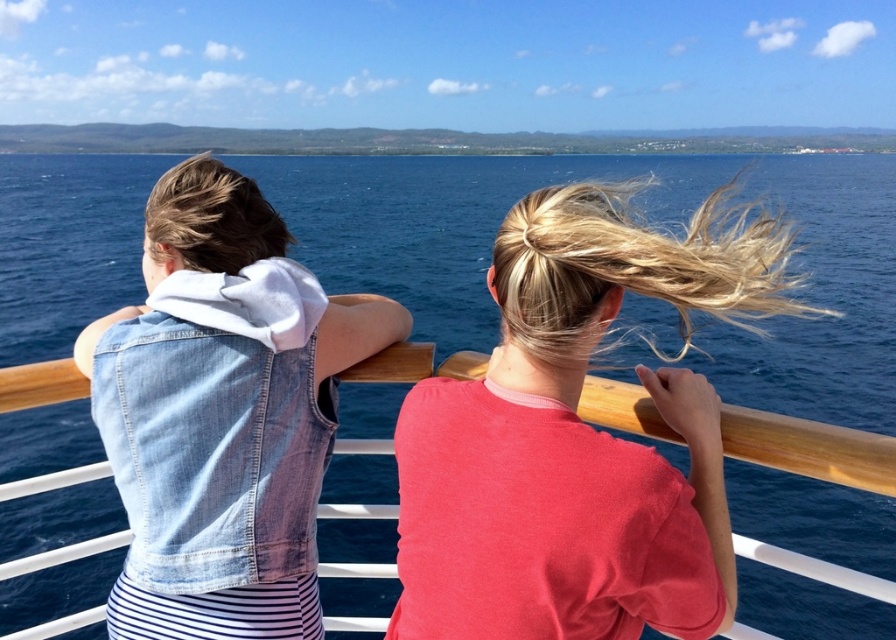
Is denim vest at left bigger than blonde silky hair at upper left?

Incorrect, denim vest at left is not larger than blonde silky hair at upper left.

Is denim vest at left wider than blonde silky hair at upper left?

No.

Measure the distance between denim vest at left and camera.

denim vest at left is 2.20 meters away from camera.

Find the location of a particular element. The width and height of the screenshot is (896, 640). denim vest at left is located at coordinates (222, 413).

Is point (121, 387) positioned before point (698, 291)?

No, it is not.

Looking at this image, is denim vest at left positioned at the back of blonde silky hair at upper right?

That is True.

Describe the element at coordinates (222, 413) in the screenshot. I see `denim vest at left` at that location.

Find the location of a particular element. denim vest at left is located at coordinates (222, 413).

The image size is (896, 640). What do you see at coordinates (629, 268) in the screenshot?
I see `blonde silky hair at upper right` at bounding box center [629, 268].

Can you confirm if blonde silky hair at upper right is shorter than blonde silky hair at upper left?

Indeed, blonde silky hair at upper right has a lesser height compared to blonde silky hair at upper left.

Is point (746, 228) closer to camera compared to point (237, 244)?

Yes, it is.

At what (x,y) coordinates should I click in order to perform the action: click on blonde silky hair at upper right. Please return your answer as a coordinate pair (x, y). The width and height of the screenshot is (896, 640). Looking at the image, I should click on (629, 268).